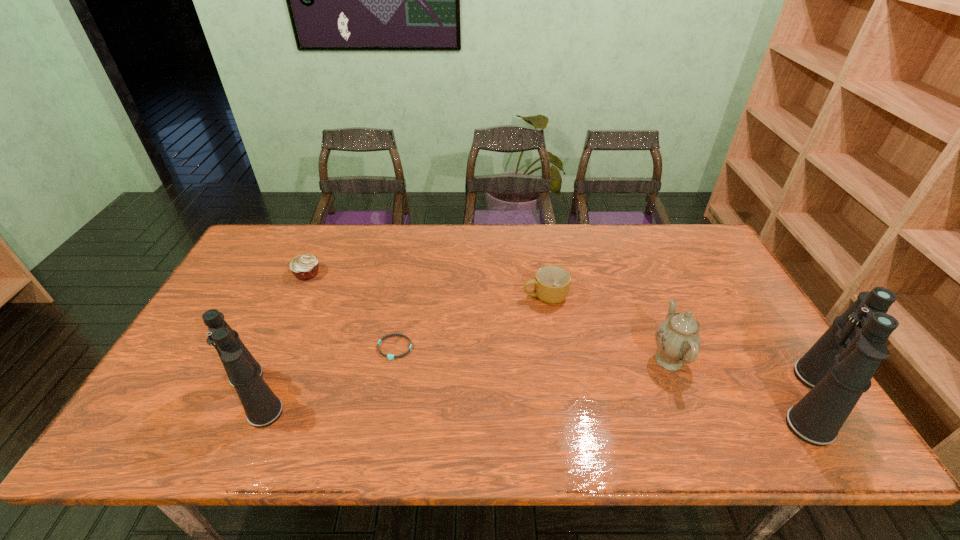
What are the coordinates of `the fourth object from left to right` in the screenshot? It's located at (551, 284).

What are the coordinates of `free location located on the left of the left binoculars` in the screenshot? It's located at coord(198,394).

Identify the location of free space located 0.150m on the back of the taller binoculars. This screenshot has width=960, height=540. tap(758, 319).

The image size is (960, 540). What are the coordinates of `vacant area situated 0.210m on the right of the farthest object` in the screenshot? It's located at (388, 273).

At what (x,y) coordinates should I click in order to perform the action: click on vacant point located 0.150m on the spout of the third tallest object. Please return your answer as a coordinate pair (x, y). This screenshot has height=540, width=960. Looking at the image, I should click on (590, 360).

The width and height of the screenshot is (960, 540). In order to click on vacant space located on the spout of the third tallest object in this screenshot , I will do `click(613, 360)`.

Locate an element on the screen. free spot located on the spout of the third tallest object is located at coordinates (617, 360).

At what (x,y) coordinates should I click in order to perform the action: click on free space located 0.140m on the buckle of the wristband. Please return your answer as a coordinate pair (x, y). Looking at the image, I should click on (384, 408).

This screenshot has height=540, width=960. What are the coordinates of `free space located on the side with the handle of the mug` in the screenshot? It's located at (412, 296).

Find the location of a particular element. free region located 0.190m on the side with the handle of the mug is located at coordinates (458, 296).